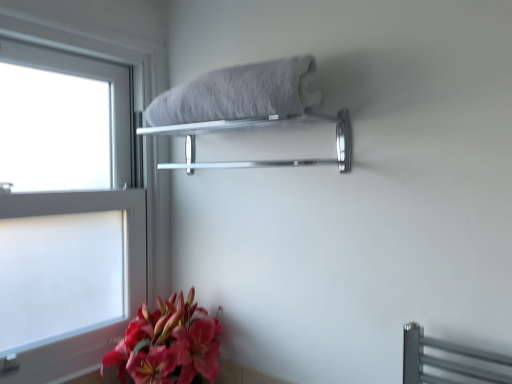
Question: Can you confirm if clear glass window at left is shorter than silver metallic towel rack at upper center?

Choices:
 (A) yes
 (B) no

Answer: (B)

Question: Considering the relative sizes of clear glass window at left and silver metallic towel rack at upper center in the image provided, is clear glass window at left wider than silver metallic towel rack at upper center?

Choices:
 (A) yes
 (B) no

Answer: (B)

Question: Is clear glass window at left looking in the opposite direction of silver metallic towel rack at upper center?

Choices:
 (A) no
 (B) yes

Answer: (A)

Question: Is clear glass window at left positioned before silver metallic towel rack at upper center?

Choices:
 (A) no
 (B) yes

Answer: (A)

Question: Can you confirm if clear glass window at left is smaller than silver metallic towel rack at upper center?

Choices:
 (A) no
 (B) yes

Answer: (A)

Question: Considering the relative positions of clear glass window at left and silver metallic towel rack at upper center in the image provided, is clear glass window at left to the right of silver metallic towel rack at upper center from the viewer's perspective?

Choices:
 (A) yes
 (B) no

Answer: (B)

Question: From the image's perspective, would you say silver metallic towel rack at upper center is shown under gray fluffy bath towel at upper center?

Choices:
 (A) no
 (B) yes

Answer: (B)

Question: Could you tell me if silver metallic towel rack at upper center is facing gray fluffy bath towel at upper center?

Choices:
 (A) yes
 (B) no

Answer: (B)

Question: Is the surface of silver metallic towel rack at upper center in direct contact with gray fluffy bath towel at upper center?

Choices:
 (A) yes
 (B) no

Answer: (A)

Question: Is silver metallic towel rack at upper center far away from gray fluffy bath towel at upper center?

Choices:
 (A) yes
 (B) no

Answer: (B)

Question: Can you confirm if silver metallic towel rack at upper center is smaller than gray fluffy bath towel at upper center?

Choices:
 (A) yes
 (B) no

Answer: (B)

Question: From the image's perspective, is silver metallic towel rack at upper center on top of gray fluffy bath towel at upper center?

Choices:
 (A) yes
 (B) no

Answer: (B)

Question: Does silver metallic towel rack at upper center have a smaller size compared to matte pink lily at lower left?

Choices:
 (A) no
 (B) yes

Answer: (B)